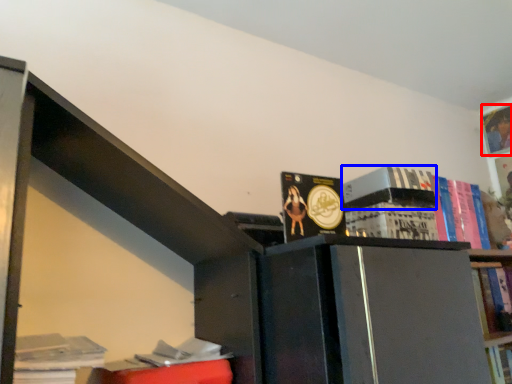
Question: Among these objects, which one is farthest to the camera, book (highlighted by a red box) or paperback book (highlighted by a blue box)?

Choices:
 (A) book
 (B) paperback book

Answer: (A)